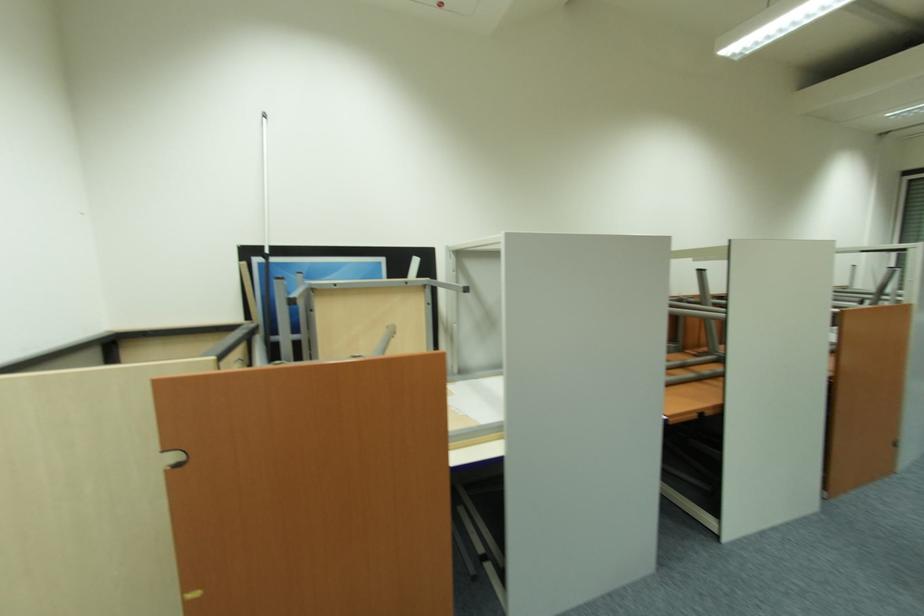
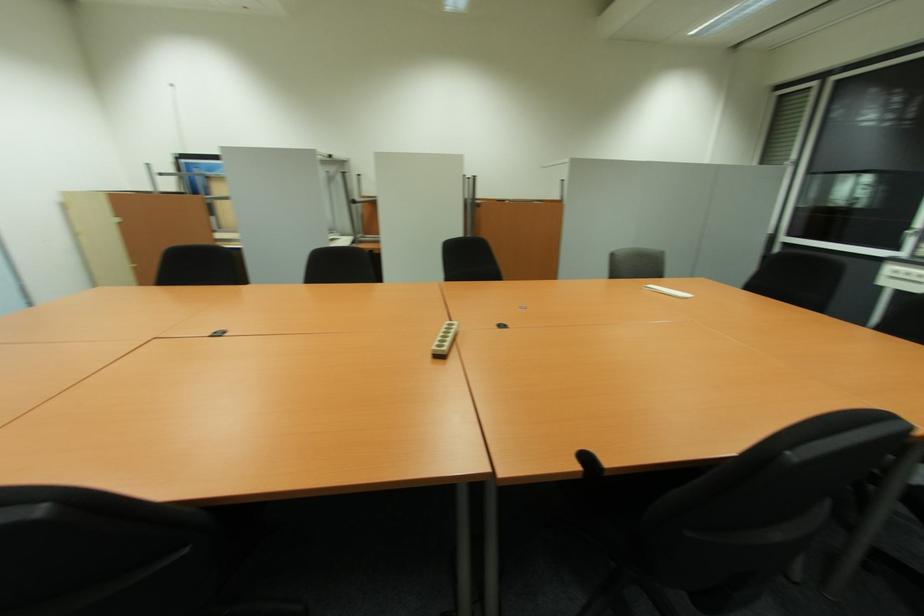
In a continuous first-person perspective shot, in which direction is the camera moving?

The cameraman moved toward right, backward.